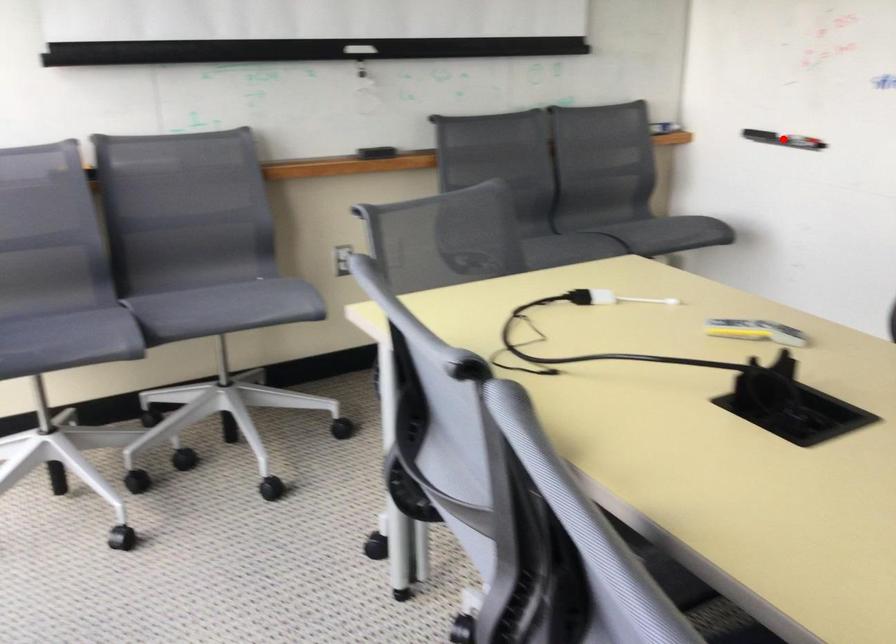
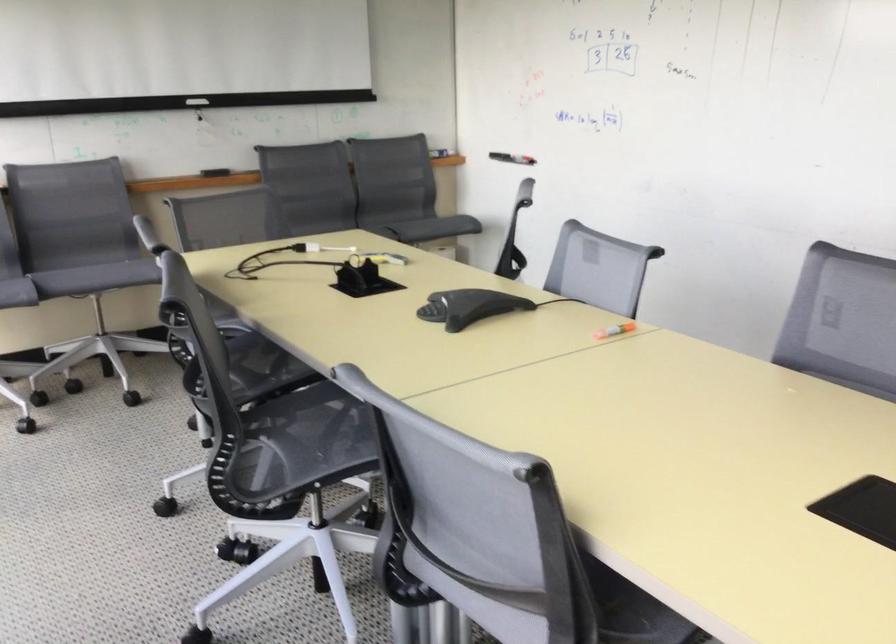
Question: I am providing you with two images of the same scene from different viewpoints. A red point is marked on the first image. Can you still see the location of the red point in image 2?

Choices:
 (A) Yes
 (B) No

Answer: (B)